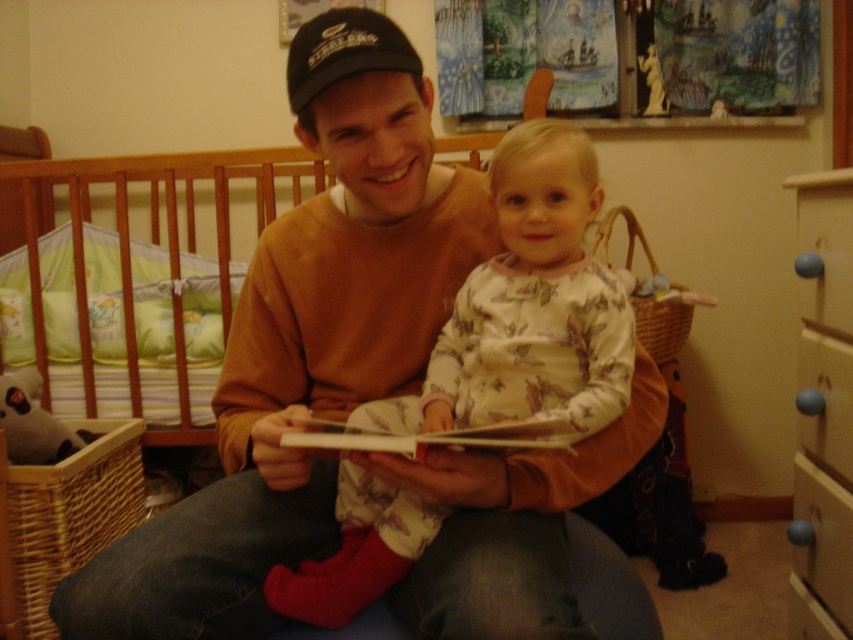
Question: Is matte orange sweater at center behind fluffy white onesie at center?

Choices:
 (A) yes
 (B) no

Answer: (B)

Question: Considering the real-world distances, which object is farthest from the fluffy white onesie at center?

Choices:
 (A) green fabric crib at left
 (B) blue plastic drawer at lower right
 (C) matte orange sweater at center
 (D) black fabric baseball cap at upper center

Answer: (A)

Question: Which object is positioned closest to the fluffy white onesie at center?

Choices:
 (A) matte orange sweater at center
 (B) blue plastic drawer at lower right
 (C) black fabric baseball cap at upper center

Answer: (A)

Question: Is fluffy white onesie at center in front of green fabric crib at left?

Choices:
 (A) yes
 (B) no

Answer: (A)

Question: Which of the following is the closest to the observer?

Choices:
 (A) black fabric baseball cap at upper center
 (B) blue plastic drawer at lower right
 (C) matte orange sweater at center
 (D) fluffy white onesie at center

Answer: (C)

Question: Is green fabric crib at left wider than black fabric baseball cap at upper center?

Choices:
 (A) no
 (B) yes

Answer: (B)